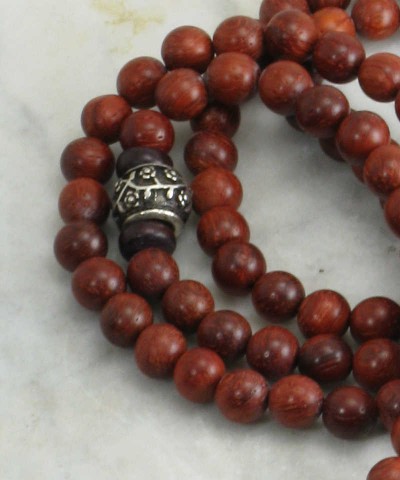
At what (x,y) coordinates should I click in order to perform the action: click on countertop. Please return your answer as a coordinate pair (x, y). The image size is (400, 480). Looking at the image, I should click on (295, 217).